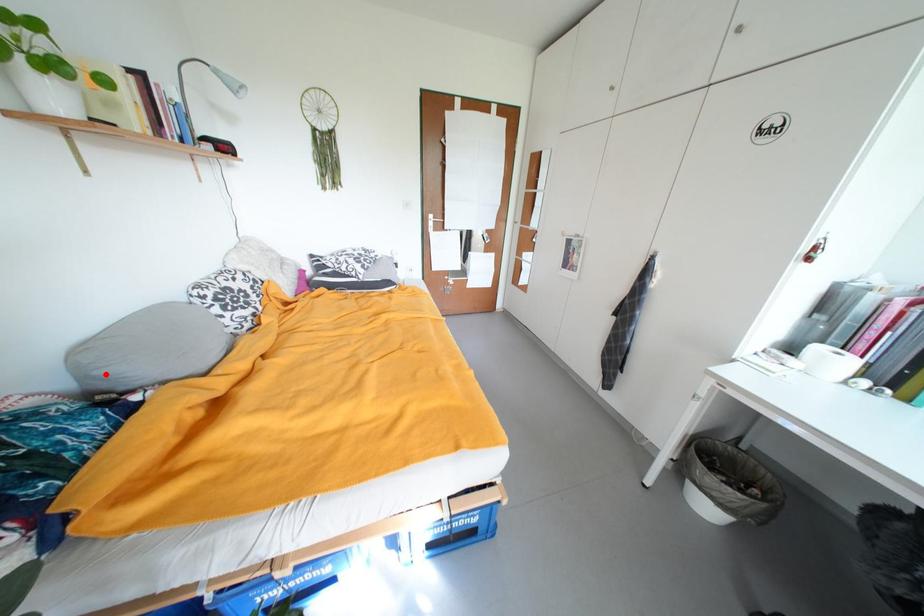
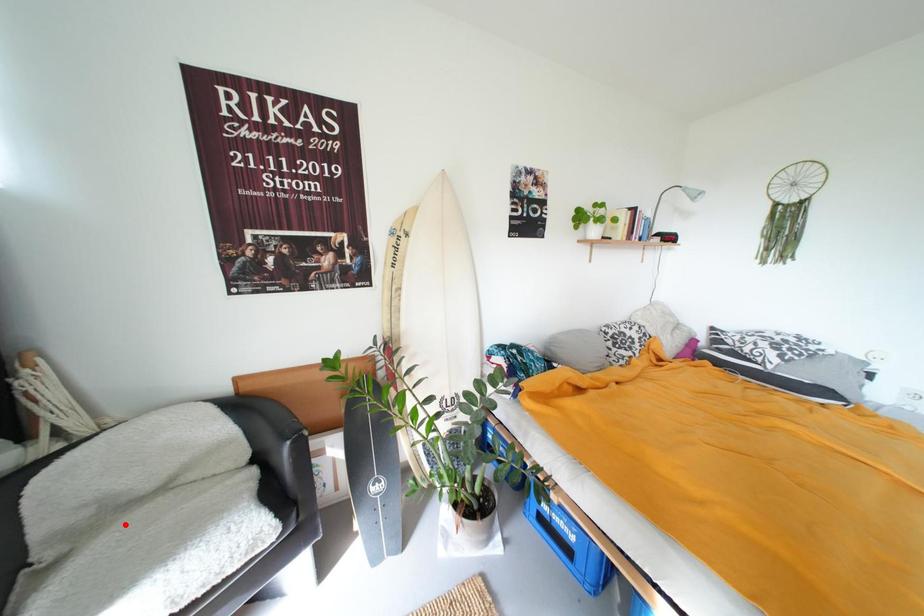
I am providing you with two images of the same scene from different viewpoints. A red point is marked on the first image and another point is marked on the second image. Do the highlighted points in image1 and image2 indicate the same real-world spot?

No